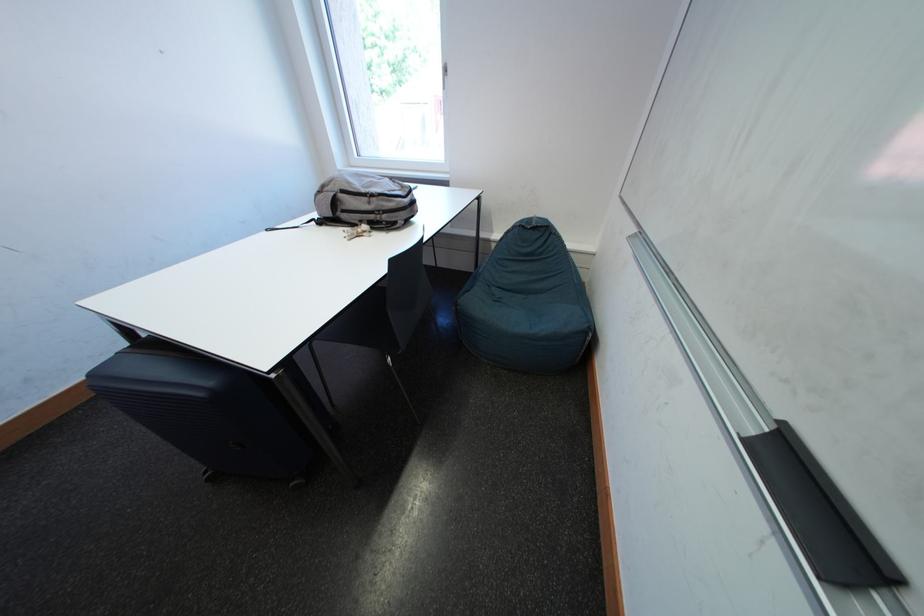
The height and width of the screenshot is (616, 924). Describe the element at coordinates (525, 309) in the screenshot. I see `the blue sofa sitting surface` at that location.